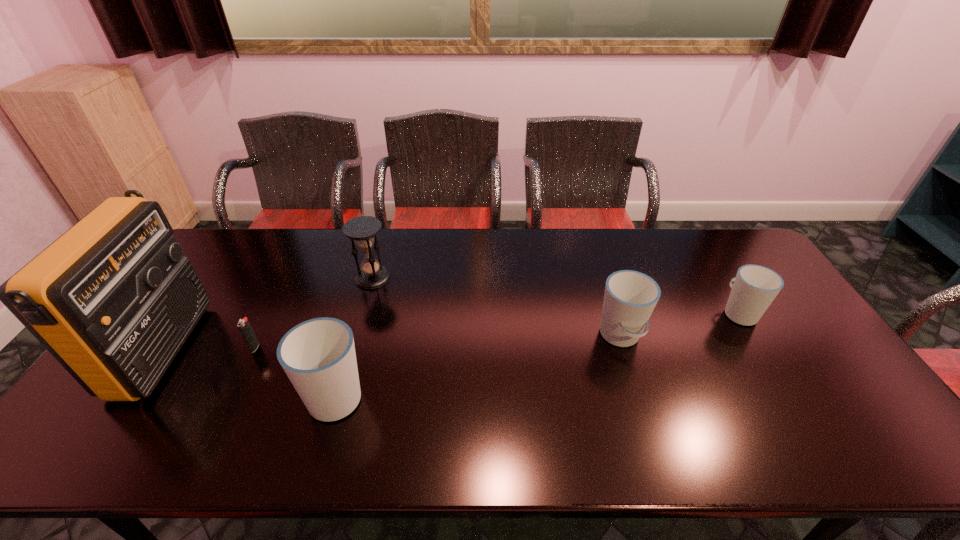
To achieve even spacing by inserting another cup among them, please point to a vacant spot for this new cup. Please provide its 2D coordinates. Your answer should be formatted as a tuple, i.e. [(x, y)], where the tuple contains the x and y coordinates of a point satisfying the conditions above.

[(487, 364)]